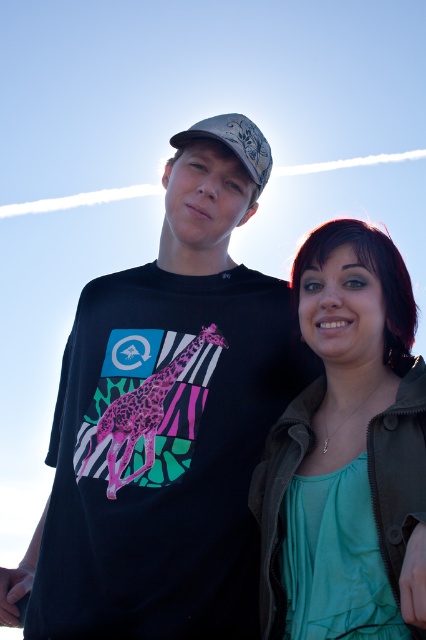
Question: Is teal fabric shirt at lower right to the left of white textured baseball cap at center from the viewer's perspective?

Choices:
 (A) no
 (B) yes

Answer: (A)

Question: Among these objects, which one is nearest to the camera?

Choices:
 (A) teal fabric shirt at lower right
 (B) black matte t-shirt at center
 (C) pink leopard print giraffe at center
 (D) white textured baseball cap at center

Answer: (B)

Question: Which object is closer to the camera taking this photo?

Choices:
 (A) white textured baseball cap at center
 (B) pink leopard print giraffe at center
 (C) black matte t-shirt at center
 (D) teal fabric shirt at lower right

Answer: (C)

Question: Which point appears farthest from the camera in this image?

Choices:
 (A) (161, 600)
 (B) (252, 125)

Answer: (B)

Question: Is pink leopard print giraffe at center to the left of white textured baseball cap at center from the viewer's perspective?

Choices:
 (A) yes
 (B) no

Answer: (A)

Question: Is black matte t-shirt at center above pink leopard print giraffe at center?

Choices:
 (A) no
 (B) yes

Answer: (B)